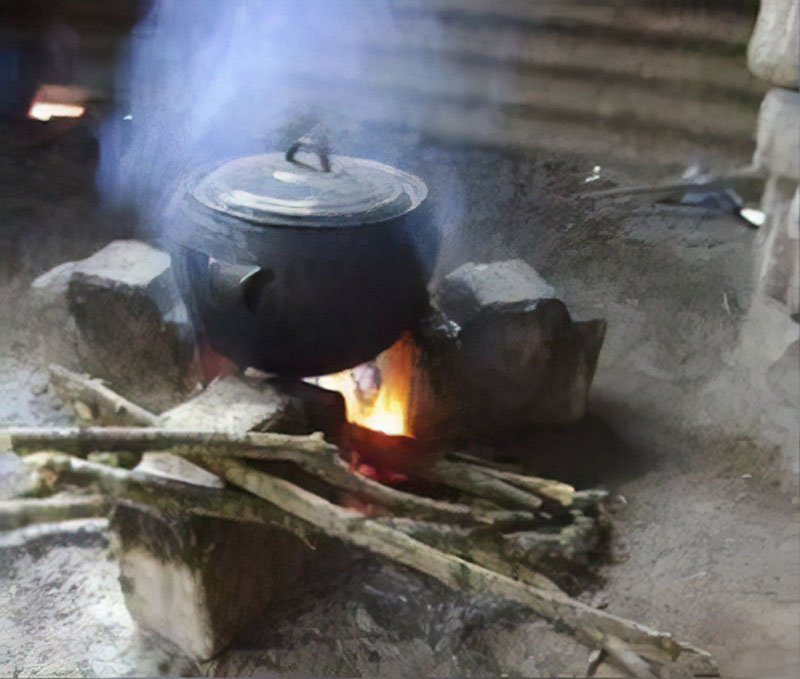
Where is `wall in background`? wall in background is located at coordinates (585, 43), (125, 32).